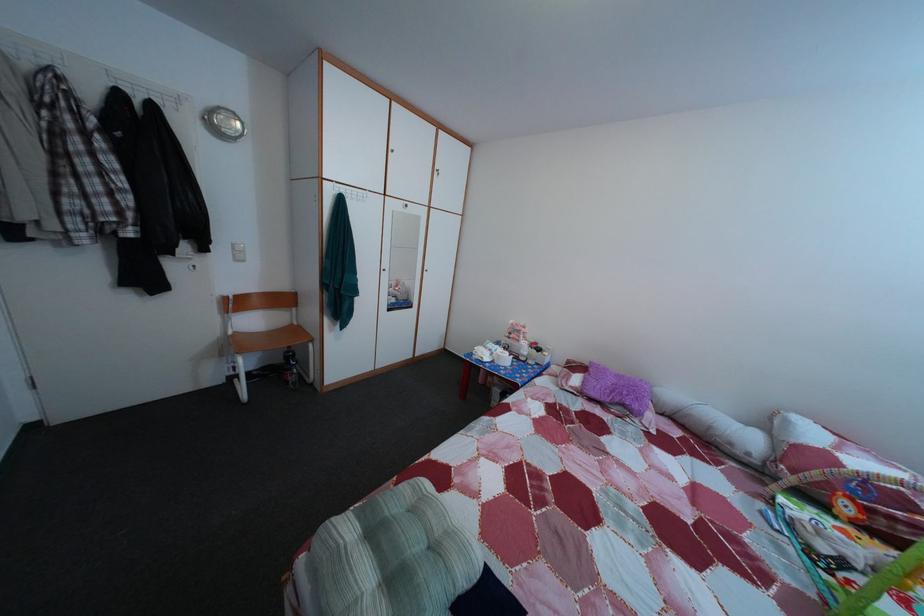
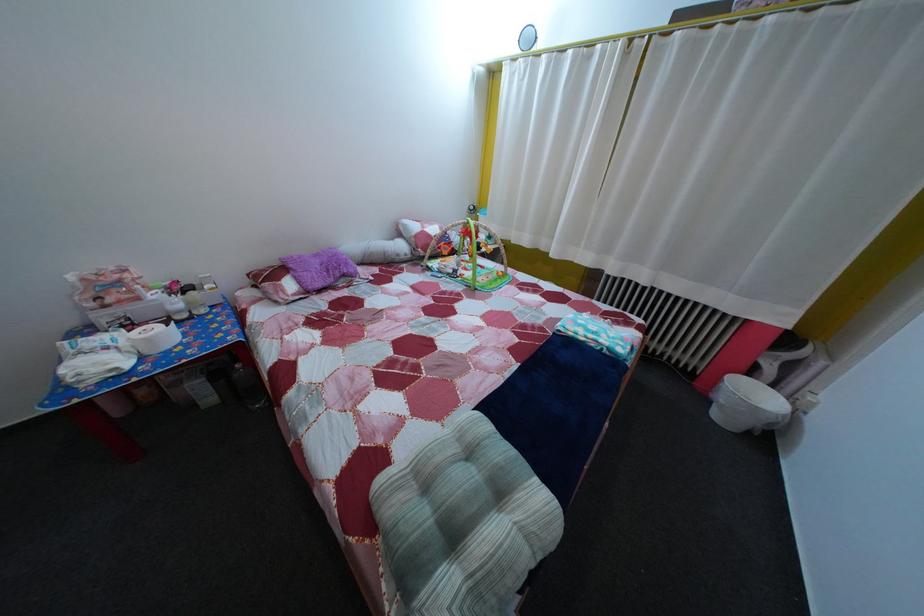
Where in the second image is the point corresponding to point 554,361 from the first image?

(216, 294)